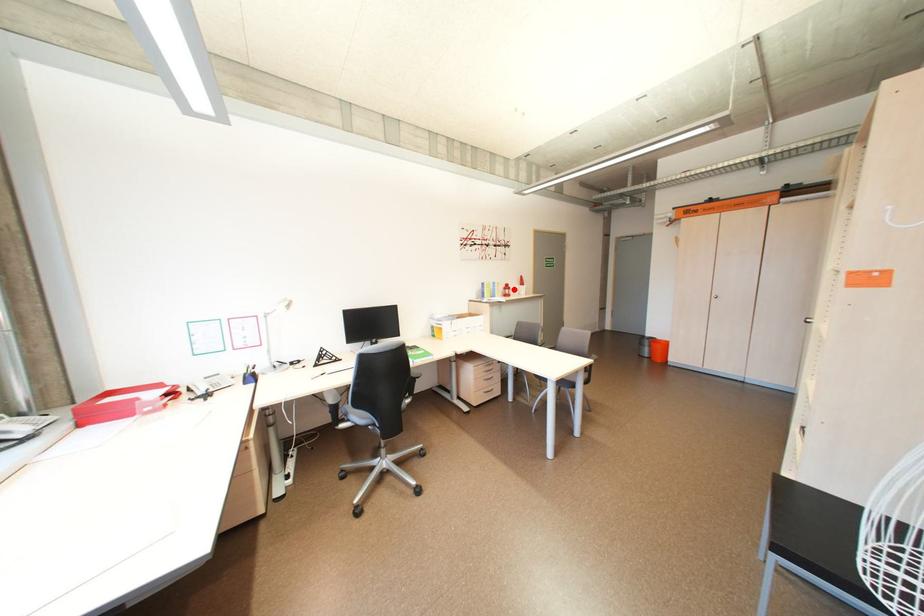
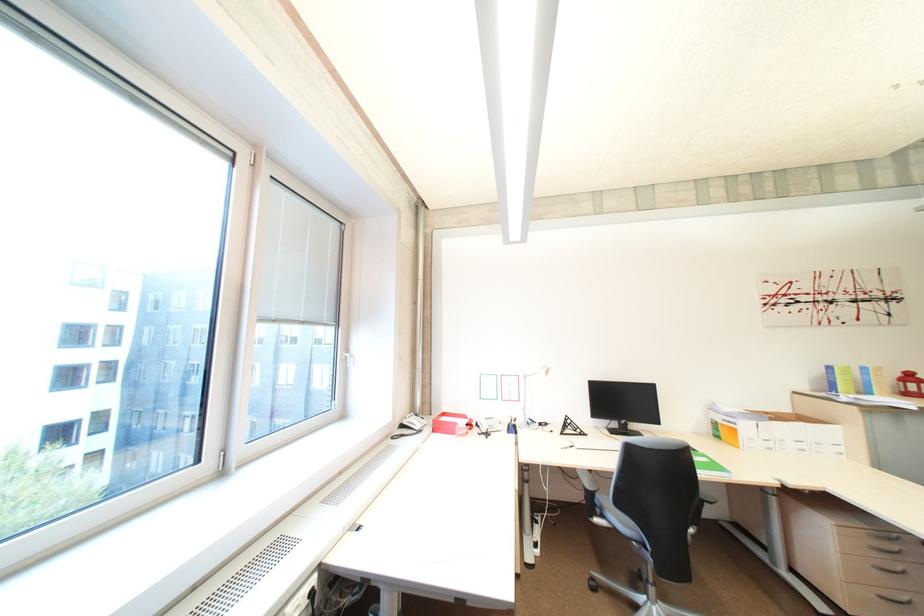
The point at the highlighted location is marked in the first image. Where is the corresponding point in the second image?

(913, 382)